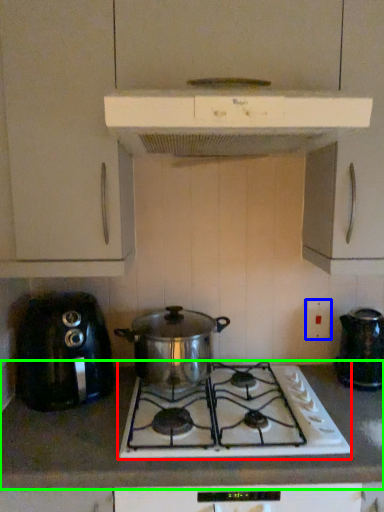
Question: Which is farther away from gas stove (highlighted by a red box)? electric outlet (highlighted by a blue box) or countertop (highlighted by a green box)?

Choices:
 (A) electric outlet
 (B) countertop

Answer: (A)